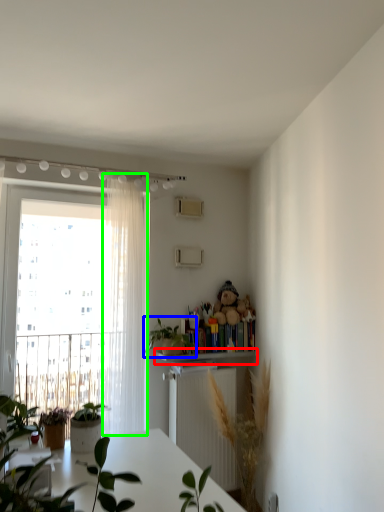
Question: Estimate the real-world distances between objects in this image. Which object is farther from shelf (highlighted by a red box), houseplant (highlighted by a blue box) or curtain (highlighted by a green box)?

Choices:
 (A) houseplant
 (B) curtain

Answer: (B)